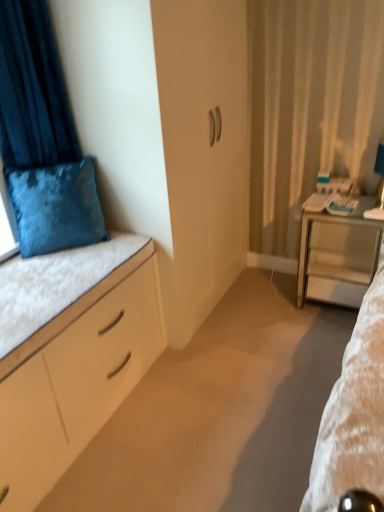
Identify the location of free spot above metallic silver desk at right (from a real-world perspective). (355, 203).